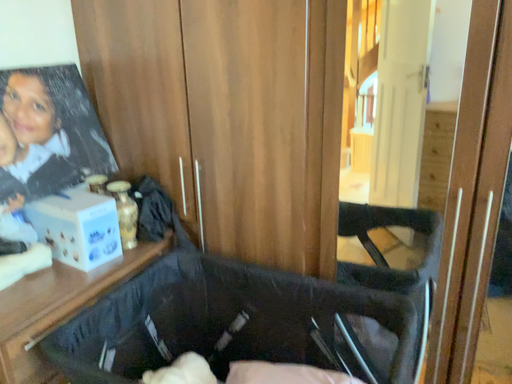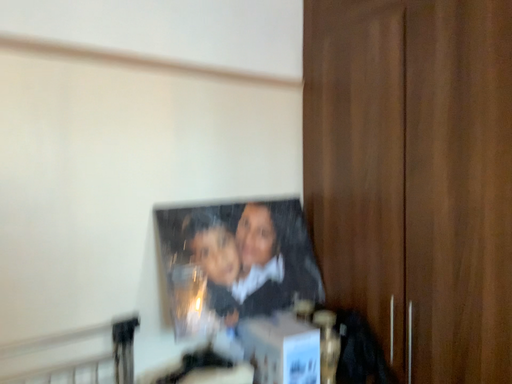
Question: How did the camera likely rotate when shooting the video?

Choices:
 (A) rotated right
 (B) rotated left

Answer: (B)